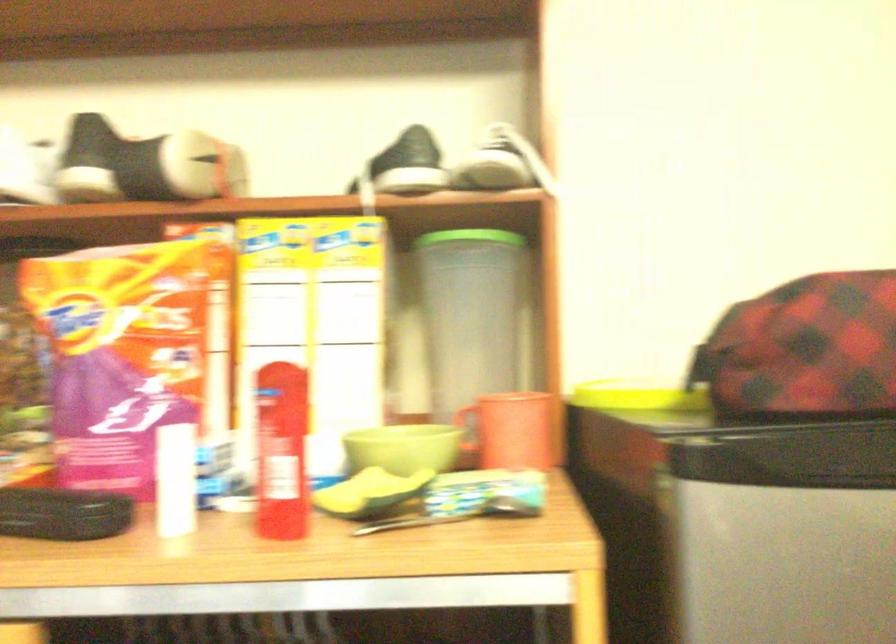
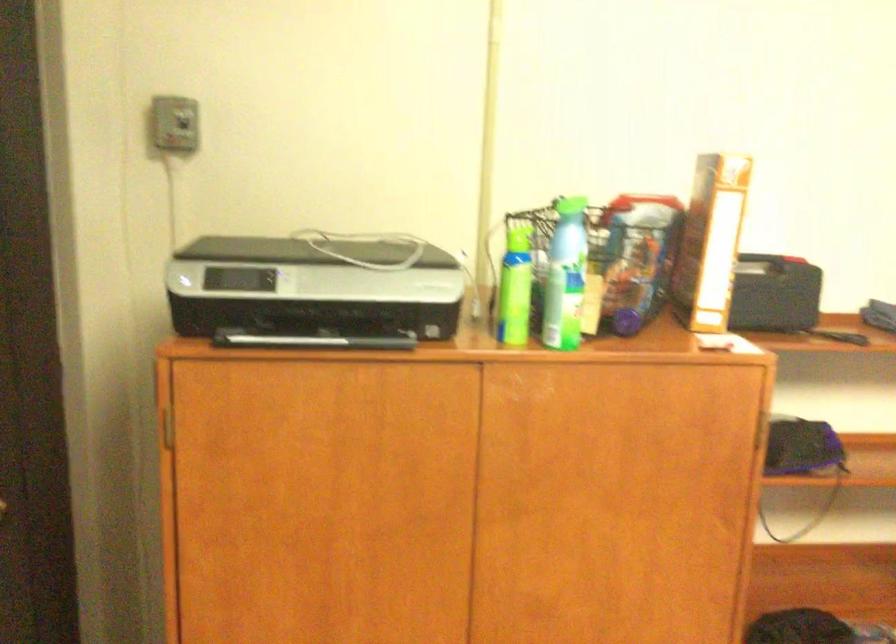
Question: The camera is either moving clockwise (left) or counter-clockwise (right) around the object. The first image is from the beginning of the video and the second image is from the end. Is the camera moving left or right when shooting the video?

Choices:
 (A) Left
 (B) Right

Answer: (A)